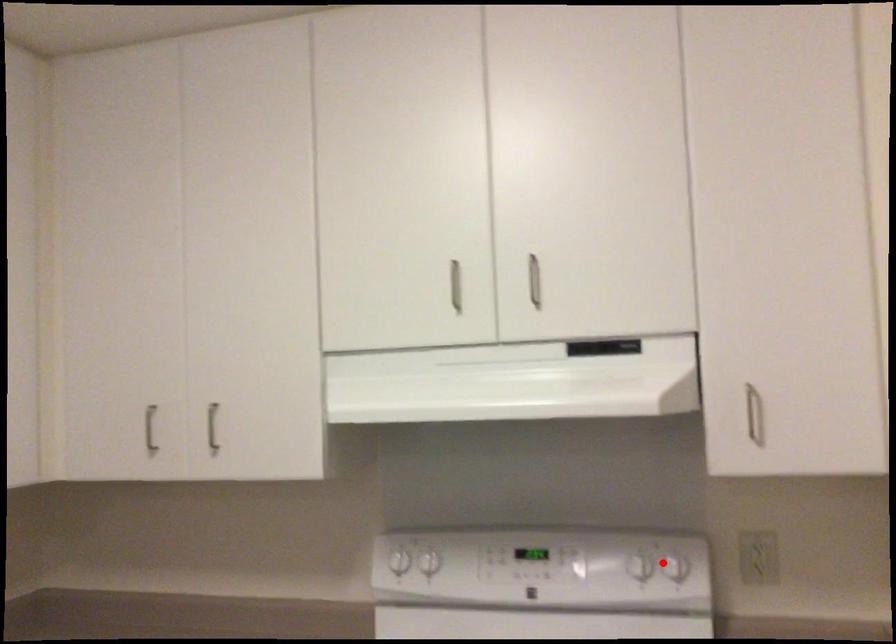
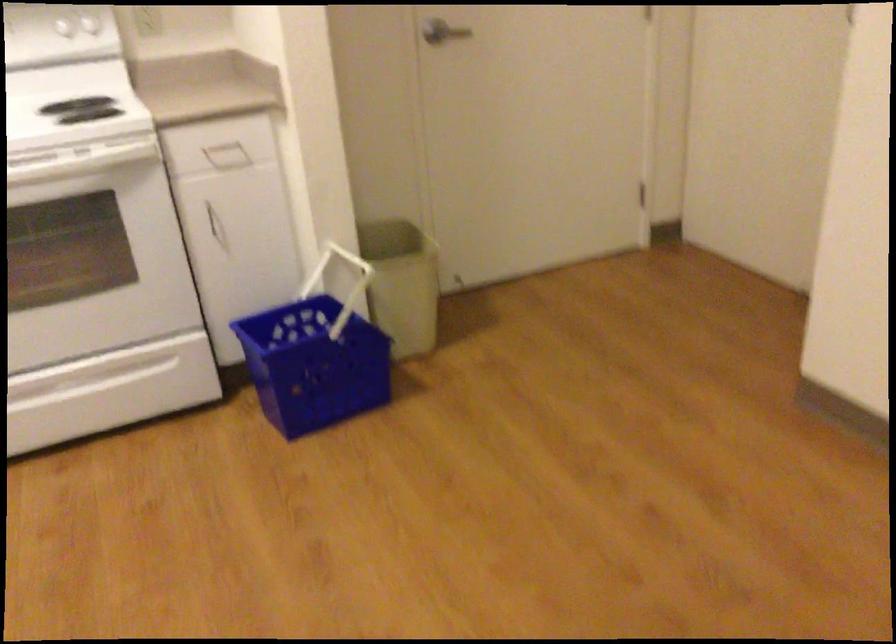
Where in the second image is the point corresponding to the highlighted location from the first image?

(80, 26)